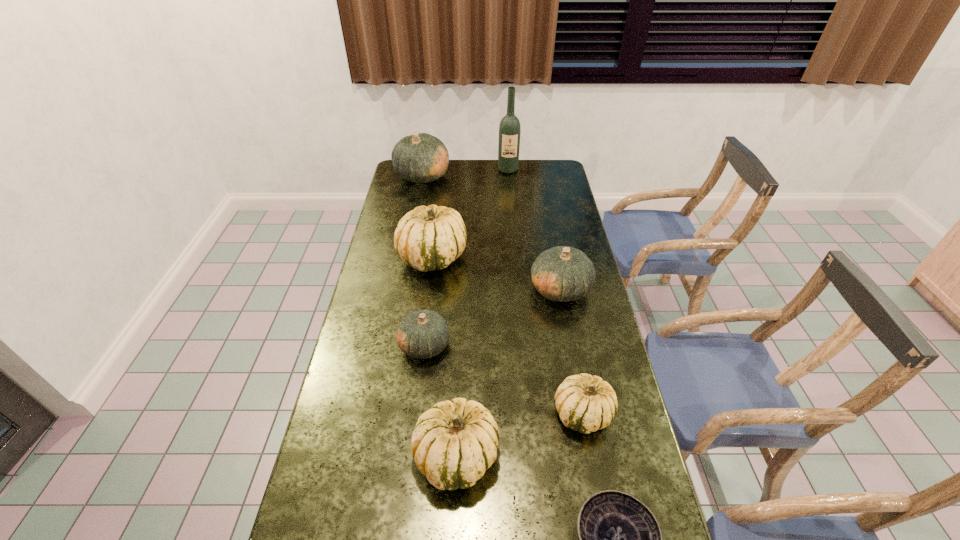
You are a GUI agent. You are given a task and a screenshot of the screen. Output one action in this format:
    pyautogui.click(x=<x>, y=<y>)
    Task: Click on the object that is at the far left corner
    This screenshot has height=540, width=960.
    Given the screenshot: What is the action you would take?
    pyautogui.click(x=419, y=158)

Locate an element on the screen. This screenshot has height=540, width=960. vacant point at the left edge is located at coordinates (335, 512).

In the image, there is a desktop. In order to click on vacant space at the right edge in this screenshot , I will do `click(565, 307)`.

Where is `free space at the far right corner of the desktop`? free space at the far right corner of the desktop is located at coordinates (539, 184).

This screenshot has height=540, width=960. Find the location of `empty space that is in between the second nearest orange gourd and the farthest gourd`. empty space that is in between the second nearest orange gourd and the farthest gourd is located at coordinates (492, 232).

Locate an element on the screen. Image resolution: width=960 pixels, height=540 pixels. free space between the rightmost orange gourd and the farthest white gourd is located at coordinates (496, 273).

I want to click on free point between the smallest orange gourd and the second nearest orange gourd, so click(x=492, y=317).

At what (x,y) coordinates should I click in order to perform the action: click on free space that is in between the biggest orange gourd and the smallest white gourd. Please return your answer as a coordinate pair (x, y). Looking at the image, I should click on (503, 295).

The width and height of the screenshot is (960, 540). What are the coordinates of `empty location between the tallest object and the farthest white gourd` in the screenshot? It's located at (470, 213).

You are a GUI agent. You are given a task and a screenshot of the screen. Output one action in this format:
    pyautogui.click(x=<x>, y=<y>)
    Task: Click on the free space between the second biggest white gourd and the second biggest orange gourd
    Image resolution: width=960 pixels, height=540 pixels.
    Given the screenshot: What is the action you would take?
    pyautogui.click(x=509, y=372)